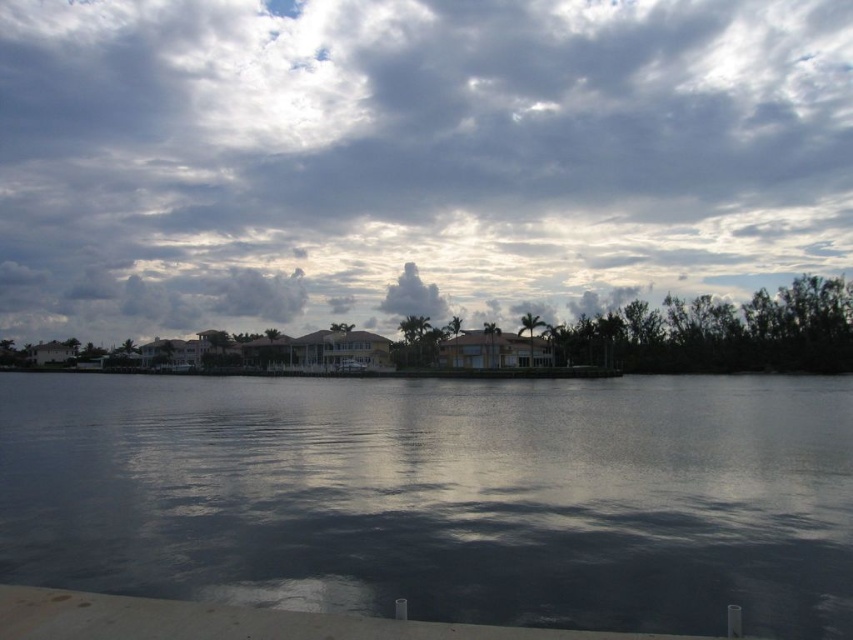
You are standing at the point labeled point (434, 314) and want to walk to the point labeled point (814, 547). Based on the scene description, will you be moving towards the waterfront or away from it?

Since point (814, 547) is in front of point (434, 314), you are moving towards the waterfront as the point is closer to the water edge.